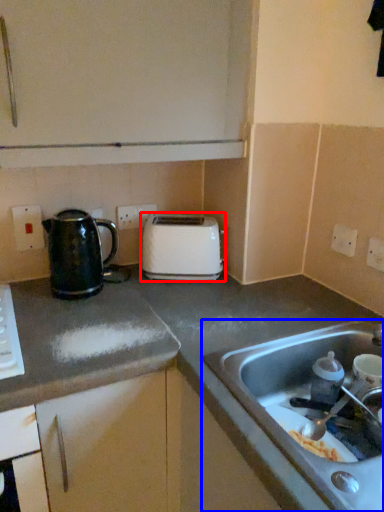
Question: Among these objects, which one is nearest to the camera, toaster (highlighted by a red box) or sink (highlighted by a blue box)?

Choices:
 (A) toaster
 (B) sink

Answer: (B)